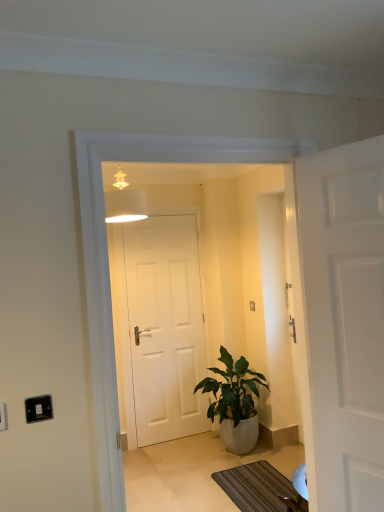
Question: Is white matte door at right, the first door positioned from the front, aimed at black plastic switch at lower left, which appears as the second electric outlet when viewed from the left?

Choices:
 (A) yes
 (B) no

Answer: (B)

Question: Is white matte door at right, the second door viewed from the left, positioned with its back to black plastic switch at lower left, which appears as the second electric outlet when viewed from the left?

Choices:
 (A) no
 (B) yes

Answer: (A)

Question: Does white matte door at right, which appears as the 2th door when viewed from the back, have a lesser height compared to black plastic switch at lower left, the 1th electric outlet viewed from the right?

Choices:
 (A) yes
 (B) no

Answer: (B)

Question: Can you confirm if white matte door at right, the second door viewed from the left, is taller than black plastic switch at lower left, the 1th electric outlet viewed from the right?

Choices:
 (A) yes
 (B) no

Answer: (A)

Question: Does white matte door at right, the second door viewed from the left, have a lesser width compared to black plastic switch at lower left, the 1th electric outlet viewed from the right?

Choices:
 (A) no
 (B) yes

Answer: (A)

Question: Based on their positions, is white plastic electric outlet at lower left, positioned as the 1th electric outlet in left-to-right order, located to the left or right of black plastic switch at lower left, which appears as the second electric outlet when viewed from the left?

Choices:
 (A) right
 (B) left

Answer: (B)

Question: Is white plastic electric outlet at lower left, acting as the 2th electric outlet starting from the right, wider or thinner than black plastic switch at lower left, which appears as the second electric outlet when viewed from the left?

Choices:
 (A) thin
 (B) wide

Answer: (B)

Question: Relative to black plastic switch at lower left, which appears as the second electric outlet when viewed from the left, is white plastic electric outlet at lower left, positioned as the 2th electric outlet in back-to-front order, in front or behind?

Choices:
 (A) behind
 (B) front

Answer: (B)

Question: Is white plastic electric outlet at lower left, acting as the 2th electric outlet starting from the right, inside the boundaries of black plastic switch at lower left, the 1th electric outlet viewed from the right, or outside?

Choices:
 (A) inside
 (B) outside

Answer: (B)

Question: Is point (261, 494) closer or farther from the camera than point (139, 198)?

Choices:
 (A) closer
 (B) farther

Answer: (B)

Question: Relative to matte white lampshade at upper center, is striped fabric doormat at lower center in front or behind?

Choices:
 (A) front
 (B) behind

Answer: (B)

Question: Considering the positions of striped fabric doormat at lower center and matte white lampshade at upper center in the image, is striped fabric doormat at lower center taller or shorter than matte white lampshade at upper center?

Choices:
 (A) tall
 (B) short

Answer: (B)

Question: Is striped fabric doormat at lower center bigger or smaller than matte white lampshade at upper center?

Choices:
 (A) small
 (B) big

Answer: (A)

Question: Do you think striped fabric doormat at lower center is within white plastic electric outlet at lower left, positioned as the 1th electric outlet in left-to-right order, or outside of it?

Choices:
 (A) outside
 (B) inside

Answer: (A)

Question: From the image's perspective, is striped fabric doormat at lower center located above or below white plastic electric outlet at lower left, which is the 1th electric outlet in front-to-back order?

Choices:
 (A) above
 (B) below

Answer: (B)